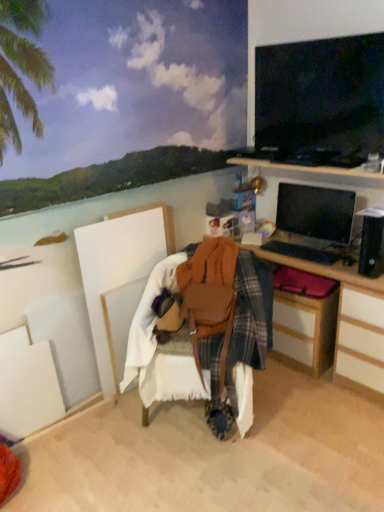
Locate an element on the screen. This screenshot has width=384, height=512. free space in front of leather at center is located at coordinates 208,479.